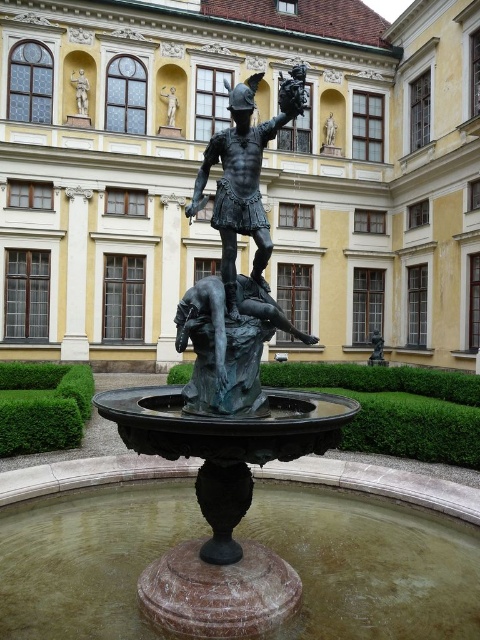
Question: Is bronze statue at upper left closer to the viewer compared to matte gold statue at upper center?

Choices:
 (A) yes
 (B) no

Answer: (A)

Question: Does yellow stone palace at center have a greater width compared to bronze statue at center?

Choices:
 (A) no
 (B) yes

Answer: (B)

Question: Among these objects, which one is nearest to the camera?

Choices:
 (A) matte gold statue at upper center
 (B) bronze statue at upper left
 (C) bronze statue at center
 (D) yellow stone palace at center

Answer: (C)

Question: Which point is closer to the camera taking this photo?

Choices:
 (A) (228, 131)
 (B) (166, 96)
 (C) (409, 260)
 (D) (79, 90)

Answer: (A)

Question: Which is nearer to the bronze statue at center?

Choices:
 (A) bronze statue at upper left
 (B) matte gold statue at upper center

Answer: (B)

Question: Is bronze statue at center above matte gold statue at upper center?

Choices:
 (A) yes
 (B) no

Answer: (B)